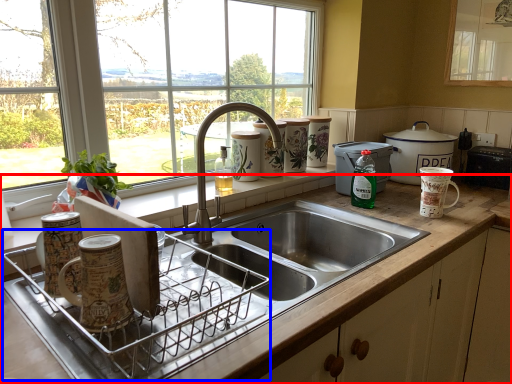
Question: Among these objects, which one is farthest to the camera, countertop (highlighted by a red box) or appliance (highlighted by a blue box)?

Choices:
 (A) countertop
 (B) appliance

Answer: (B)